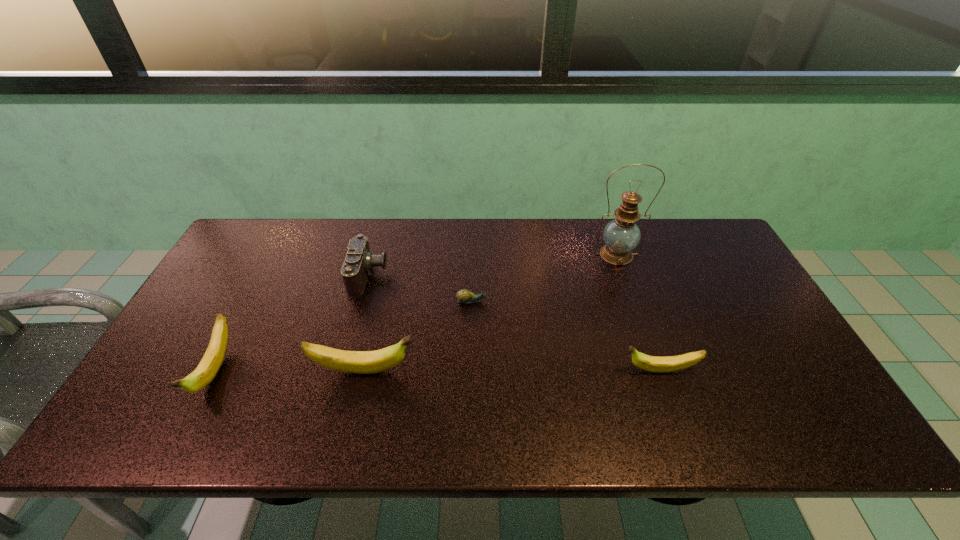
Identify the location of free point between the leftmost banana and the oil lamp. coord(416,313).

At what (x,y) coordinates should I click in order to perform the action: click on vacant area between the escargot and the second tallest banana. Please return your answer as a coordinate pair (x, y). The width and height of the screenshot is (960, 540). Looking at the image, I should click on (x=344, y=336).

The height and width of the screenshot is (540, 960). I want to click on unoccupied area between the escargot and the tallest object, so click(544, 278).

Image resolution: width=960 pixels, height=540 pixels. In order to click on vacant space in between the leftmost object and the second banana from right to left in this screenshot , I will do `click(290, 371)`.

I want to click on free space between the leftmost object and the camera, so click(x=292, y=323).

I want to click on the fifth closest object to the second banana from left to right, so click(621, 235).

Image resolution: width=960 pixels, height=540 pixels. In order to click on object that can be found as the closest to the rightmost banana in this screenshot , I will do `click(621, 235)`.

You are a GUI agent. You are given a task and a screenshot of the screen. Output one action in this format:
    pyautogui.click(x=<x>, y=<y>)
    Task: Click on the banana that is the closest to the second banana from right to left
    
    Given the screenshot: What is the action you would take?
    pyautogui.click(x=210, y=364)

Where is `banana that is the closest to the second tallest banana`? This screenshot has width=960, height=540. banana that is the closest to the second tallest banana is located at coordinates pyautogui.click(x=361, y=362).

Find the location of a particular element. The image size is (960, 540). free region that satisfies the following two spatial constraints: 1. on the front side of the oil lamp; 2. on the front-facing side of the camera is located at coordinates pyautogui.click(x=624, y=275).